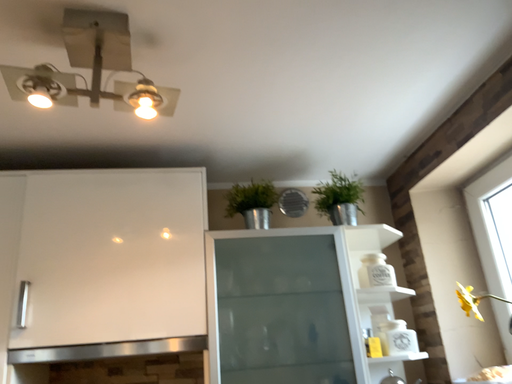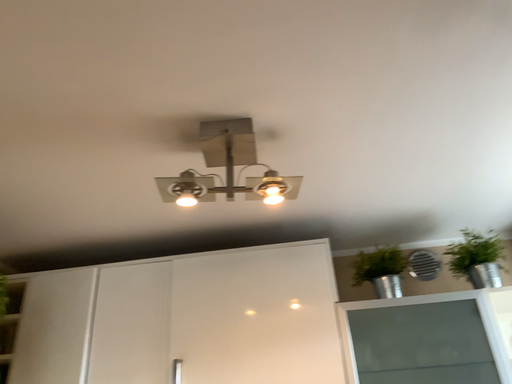
Question: How did the camera likely rotate when shooting the video?

Choices:
 (A) rotated right
 (B) rotated left

Answer: (B)